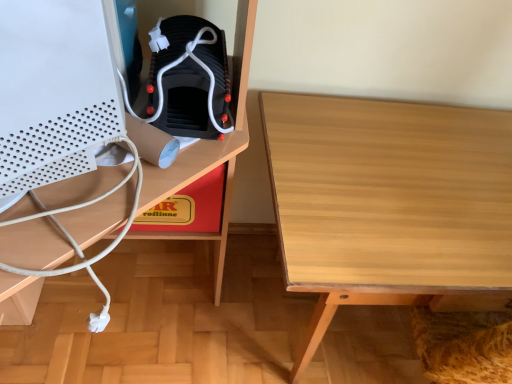
In order to face light wood table at center, should I rotate leftwards or rightwards?

You should rotate right by 23.499 degrees.

What do you see at coordinates (389, 204) in the screenshot?
I see `light wood table at center` at bounding box center [389, 204].

You are a GUI agent. You are given a task and a screenshot of the screen. Output one action in this format:
    pyautogui.click(x=<x>, y=<y>)
    Task: Click on the white matte desktop computer at left
    The image size is (512, 384).
    Given the screenshot: What is the action you would take?
    coord(53,93)

At what (x,y) coordinates should I click in order to perform the action: click on footwear above the red cardboard box at center (from the image's perspective). Please return your answer as a coordinate pair (x, y). This screenshot has height=384, width=512. Looking at the image, I should click on (190, 79).

Based on the photo, is black matte boot at center thinner than red cardboard box at center?

Yes, black matte boot at center is thinner than red cardboard box at center.

Could you tell me if black matte boot at center is turned towards red cardboard box at center?

No, black matte boot at center does not turn towards red cardboard box at center.

How many degrees apart are the facing directions of black matte boot at center and red cardboard box at center?

black matte boot at center and red cardboard box at center are facing 2.34 degrees away from each other.

From the image's perspective, who appears lower, light wood table at center or red cardboard box at center?

light wood table at center, from the image's perspective.

In the scene shown: Does light wood table at center appear on the left side of red cardboard box at center?

No, light wood table at center is not to the left of red cardboard box at center.

Which is behind, point (290, 239) or point (194, 184)?

Positioned behind is point (194, 184).

Is light wood table at center far away from red cardboard box at center?

light wood table at center is actually quite close to red cardboard box at center.

Is white matte desktop computer at left situated inside light wood table at center or outside?

white matte desktop computer at left exists outside the volume of light wood table at center.

Considering the points (3, 56) and (378, 216), which point is in front, point (3, 56) or point (378, 216)?

The point (3, 56) is closer to the camera.

In the image, is white matte desktop computer at left on the left side or the right side of black matte boot at center?

In the image, white matte desktop computer at left appears on the left side of black matte boot at center.

Considering the relative sizes of white matte desktop computer at left and black matte boot at center in the image provided, is white matte desktop computer at left taller than black matte boot at center?

Correct, white matte desktop computer at left is much taller as black matte boot at center.

Is white matte desktop computer at left in front of or behind black matte boot at center in the image?

Visually, white matte desktop computer at left is located in front of black matte boot at center.

Is white matte desktop computer at left oriented towards black matte boot at center?

No, white matte desktop computer at left is not aimed at black matte boot at center.

Is red cardboard box at center at the back of white matte desktop computer at left?

No.

From a real-world perspective, relative to red cardboard box at center, is white matte desktop computer at left vertically above or below?

Clearly, from a real-world perspective, white matte desktop computer at left is above red cardboard box at center.

At what (x,y) coordinates should I click in order to perform the action: click on cardboard box below the white matte desktop computer at left (from a real-world perspective). Please return your answer as a coordinate pair (x, y). Looking at the image, I should click on (189, 207).

Is white matte desktop computer at left smaller than red cardboard box at center?

Actually, white matte desktop computer at left might be larger than red cardboard box at center.

Is red cardboard box at center placed right next to black matte boot at center?

They are not placed beside each other.

Is the position of red cardboard box at center more distant than that of black matte boot at center?

Yes, the depth of red cardboard box at center is greater than that of black matte boot at center.

How different are the orientations of red cardboard box at center and black matte boot at center in degrees?

There is a 2.34-degree angle between the facing directions of red cardboard box at center and black matte boot at center.

Who is taller, red cardboard box at center or black matte boot at center?

red cardboard box at center.

How far apart are red cardboard box at center and white matte desktop computer at left?

A distance of 18.50 inches exists between red cardboard box at center and white matte desktop computer at left.

Is red cardboard box at center smaller than white matte desktop computer at left?

Yes, red cardboard box at center is smaller than white matte desktop computer at left.

Considering the sizes of objects red cardboard box at center and white matte desktop computer at left in the image provided, who is wider, red cardboard box at center or white matte desktop computer at left?

With larger width is red cardboard box at center.

Consider the image. From a real-world perspective, is red cardboard box at center under white matte desktop computer at left?

Indeed, from a real-world perspective, red cardboard box at center is positioned beneath white matte desktop computer at left.

At what (x,y) coordinates should I click in order to perform the action: click on cardboard box below the black matte boot at center (from a real-world perspective). Please return your answer as a coordinate pair (x, y). This screenshot has width=512, height=384. Looking at the image, I should click on (189, 207).

Image resolution: width=512 pixels, height=384 pixels. I want to click on table that appears on the right of red cardboard box at center, so click(x=389, y=204).

Looking at the image, which one is located closer to light wood table at center, black matte boot at center or red cardboard box at center?

The object closer to light wood table at center is black matte boot at center.

Considering their positions, is red cardboard box at center positioned further to light wood table at center than black matte boot at center?

red cardboard box at center is further to light wood table at center.

From the image, which object appears to be nearer to black matte boot at center, light wood table at center or white matte desktop computer at left?

white matte desktop computer at left is positioned closer to the anchor black matte boot at center.

Based on their spatial positions, is red cardboard box at center or light wood table at center further from white matte desktop computer at left?

light wood table at center is positioned further to the anchor white matte desktop computer at left.

Looking at the image, which one is located further to red cardboard box at center, light wood table at center or black matte boot at center?

Among the two, light wood table at center is located further to red cardboard box at center.

Based on their spatial positions, is red cardboard box at center or white matte desktop computer at left closer to light wood table at center?

The object closer to light wood table at center is red cardboard box at center.

From the image, which object appears to be nearer to light wood table at center, black matte boot at center or white matte desktop computer at left?

The object closer to light wood table at center is black matte boot at center.

Considering their positions, is black matte boot at center positioned further to white matte desktop computer at left than light wood table at center?

The object further to white matte desktop computer at left is light wood table at center.

At what (x,y) coordinates should I click in order to perform the action: click on cardboard box between white matte desktop computer at left and light wood table at center. Please return your answer as a coordinate pair (x, y). Looking at the image, I should click on (189, 207).

The image size is (512, 384). Find the location of `footwear between white matte desktop computer at left and light wood table at center in the horizontal direction`. footwear between white matte desktop computer at left and light wood table at center in the horizontal direction is located at coordinates (190, 79).

Image resolution: width=512 pixels, height=384 pixels. I want to click on footwear between white matte desktop computer at left and red cardboard box at center from front to back, so click(x=190, y=79).

Where is `footwear between red cardboard box at center and light wood table at center`? The height and width of the screenshot is (384, 512). footwear between red cardboard box at center and light wood table at center is located at coordinates (190, 79).